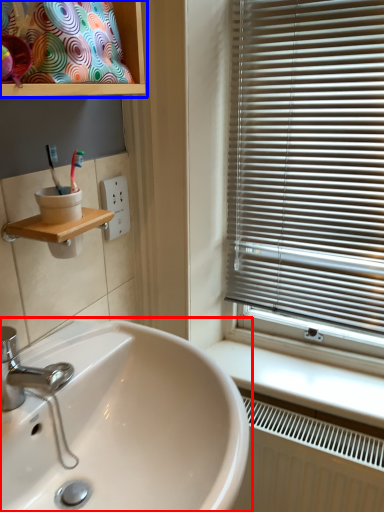
Question: Which point is further to the camera, sink (highlighted by a red box) or cabinet (highlighted by a blue box)?

Choices:
 (A) sink
 (B) cabinet

Answer: (B)